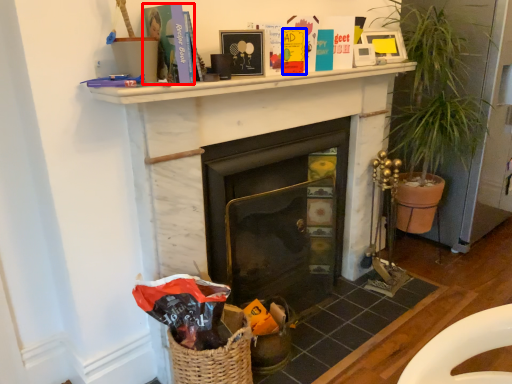
Question: Which point is further to the camera, paperback book (highlighted by a red box) or paperback book (highlighted by a blue box)?

Choices:
 (A) paperback book
 (B) paperback book

Answer: (B)